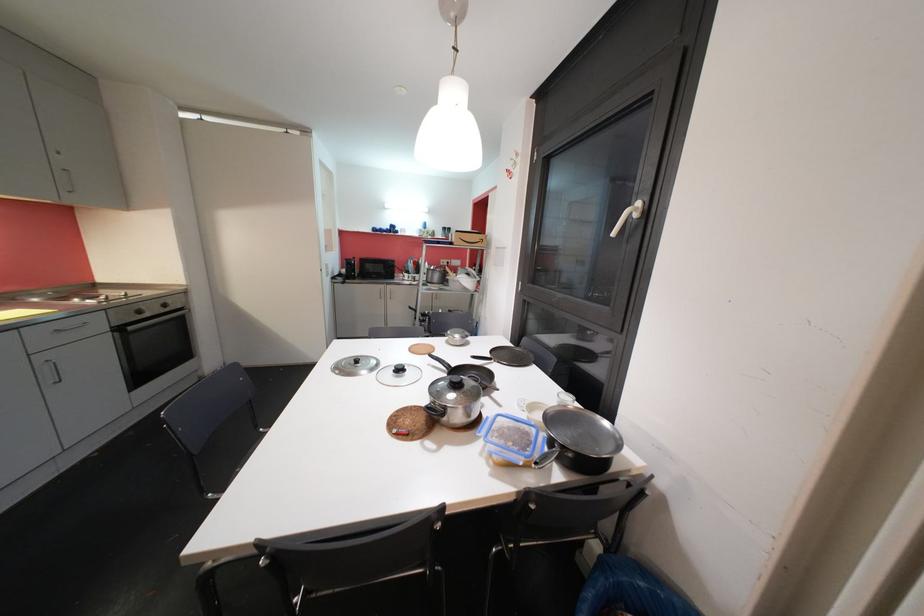
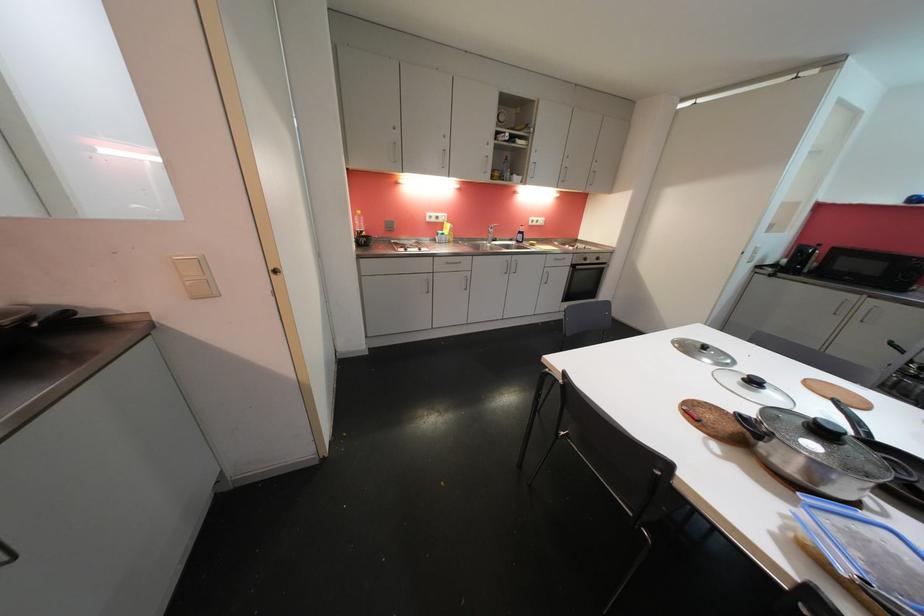
Based on the continuous images, in which direction is the camera rotating?

The camera's rotation is toward left-down.